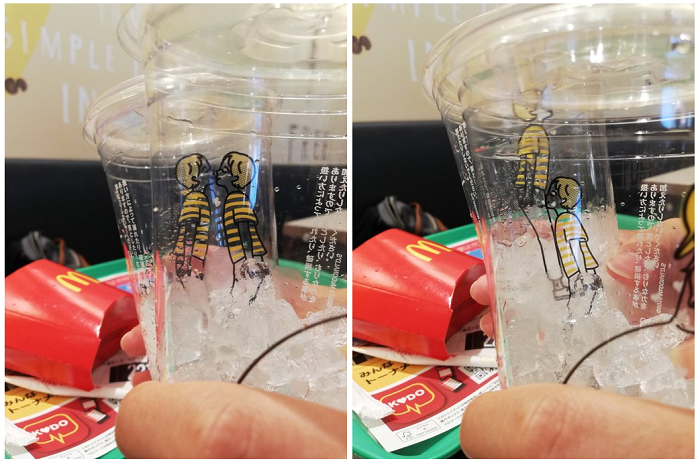
The image size is (700, 463). Find the location of `green tray`. green tray is located at coordinates coord(116,266), coord(461,233).